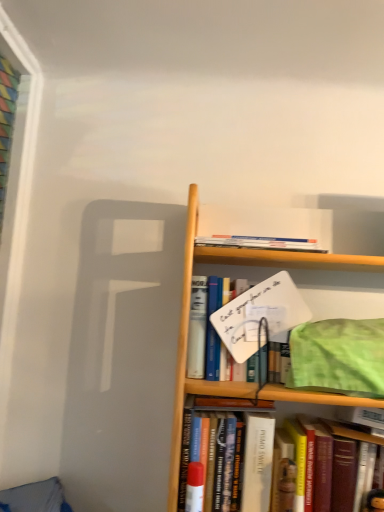
This screenshot has width=384, height=512. What are the coordinates of `vacant region above hardcover book at center, the 4th book when ordered from top to bottom (from a real-world perspective)` in the screenshot? It's located at (232, 408).